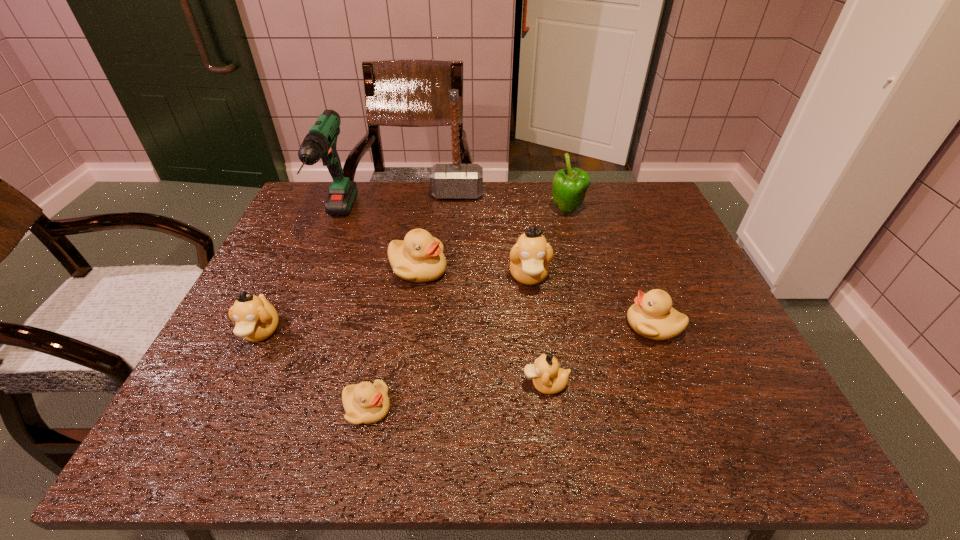
The height and width of the screenshot is (540, 960). What are the coordinates of `blank space located on the face of the second smallest tan duckling` in the screenshot? It's located at (224, 409).

You are a GUI agent. You are given a task and a screenshot of the screen. Output one action in this format:
    pyautogui.click(x=<x>, y=<y>)
    Task: Click on the vacant space situated on the beak of the rightmost object
    The image size is (960, 540).
    Given the screenshot: What is the action you would take?
    533,326

You are a GUI agent. You are given a task and a screenshot of the screen. Output one action in this format:
    pyautogui.click(x=<x>, y=<y>)
    Task: Click on the blank space located 0.370m on the beak of the rightmost object
    The width and height of the screenshot is (960, 540).
    Given the screenshot: What is the action you would take?
    pyautogui.click(x=461, y=326)

Find the location of a particular element. The height and width of the screenshot is (540, 960). vacant space located on the beak of the rightmost object is located at coordinates (528, 326).

The width and height of the screenshot is (960, 540). What are the coordinates of `vacant area situated on the face of the smallest tan duckling` in the screenshot? It's located at (442, 384).

Where is `free spot located on the face of the smallest tan duckling`? This screenshot has width=960, height=540. free spot located on the face of the smallest tan duckling is located at coordinates (472, 384).

At what (x,y) coordinates should I click in order to perform the action: click on vacant position located 0.110m on the face of the smallest tan duckling. Please return your answer as a coordinate pair (x, y). Image resolution: width=960 pixels, height=540 pixels. Looking at the image, I should click on (467, 384).

Where is `vacant region located 0.220m on the beak of the shortest object`? This screenshot has width=960, height=540. vacant region located 0.220m on the beak of the shortest object is located at coordinates (508, 409).

The width and height of the screenshot is (960, 540). I want to click on hammer that is at the far edge, so click(x=455, y=180).

The width and height of the screenshot is (960, 540). Identify the location of drill situated at the far edge. (320, 142).